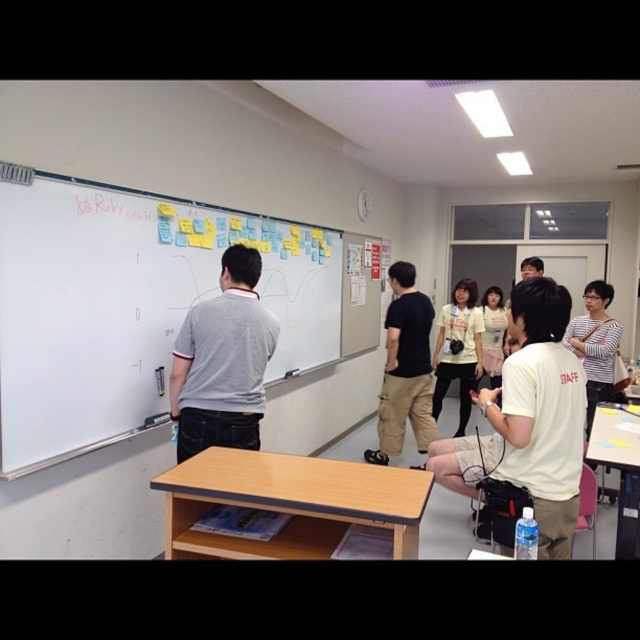
Does white cotton shirt at center have a lesser height compared to black cotton shirt at center?

Correct, white cotton shirt at center is not as tall as black cotton shirt at center.

Measure the distance between white cotton shirt at center and black cotton shirt at center.

white cotton shirt at center and black cotton shirt at center are 1.49 meters apart.

Describe the element at coordinates (529, 419) in the screenshot. I see `white cotton shirt at center` at that location.

Find the location of a particular element. This screenshot has height=640, width=640. white cotton shirt at center is located at coordinates (529, 419).

Which of these two, white matte whiteboard at upper left or yellow matte shirt at center, stands shorter?

white matte whiteboard at upper left

From the picture: Between white matte whiteboard at upper left and yellow matte shirt at center, which one has more height?

With more height is yellow matte shirt at center.

The image size is (640, 640). In order to click on white matte whiteboard at upper left in this screenshot , I will do `click(141, 305)`.

Does white cotton shirt at center have a greater width compared to gray cotton shirt at center?

Incorrect, white cotton shirt at center's width does not surpass gray cotton shirt at center's.

Does point (515, 394) lie behind point (244, 412)?

That is False.

Find the location of `white cotton shirt at center`. white cotton shirt at center is located at coordinates (529, 419).

Where is `white cotton shirt at center`? white cotton shirt at center is located at coordinates (529, 419).